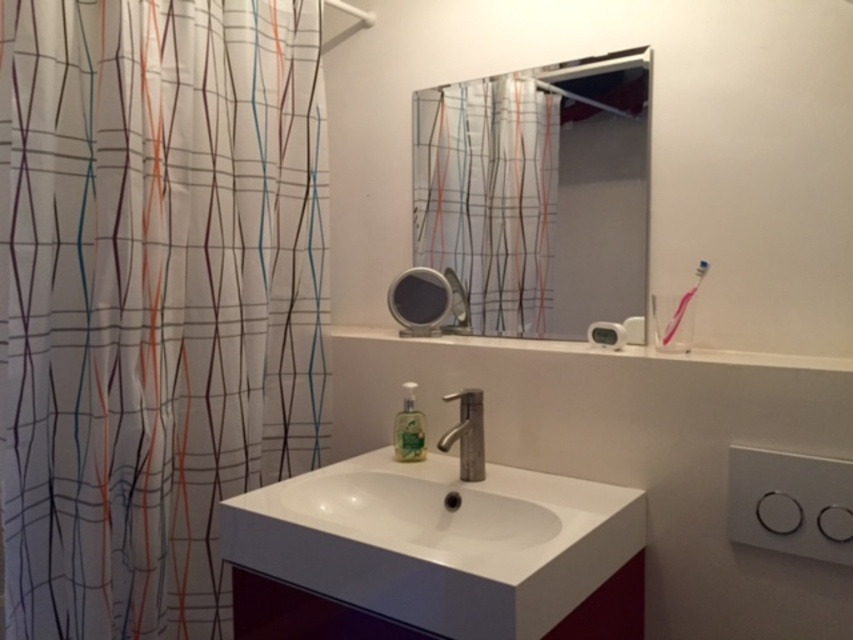
Looking at this image, you are standing in the bathroom and want to reach the silver metallic faucet at center to wash your hands. However, there is a transparent plastic shower curtain at left blocking your path. Can you still reach the faucet without moving the shower curtain?

The transparent plastic shower curtain at left is to the left of the silver metallic faucet at center, so it is positioned to the side of the faucet. You can still reach the silver metallic faucet at center without moving the shower curtain because it is not directly in front of the faucet.

You are a guest in this bathroom and want to wash your hands. The sink has a silver metallic faucet at center and a translucent green liquid at sink. Which object should you use to get water and soap?

You should use the silver metallic faucet at center to get water and the translucent green liquid at sink as soap.